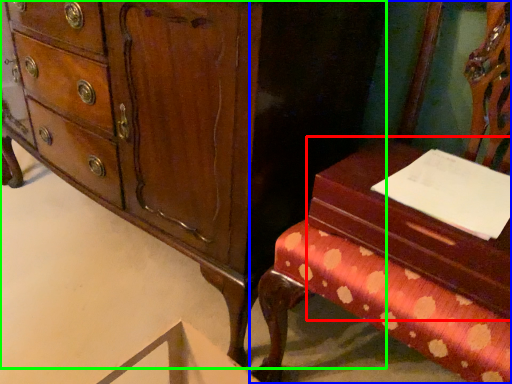
Question: Which is nearer to the vanity (highlighted by a red box)? furniture (highlighted by a blue box) or chest of drawers (highlighted by a green box).

Choices:
 (A) furniture
 (B) chest of drawers

Answer: (A)